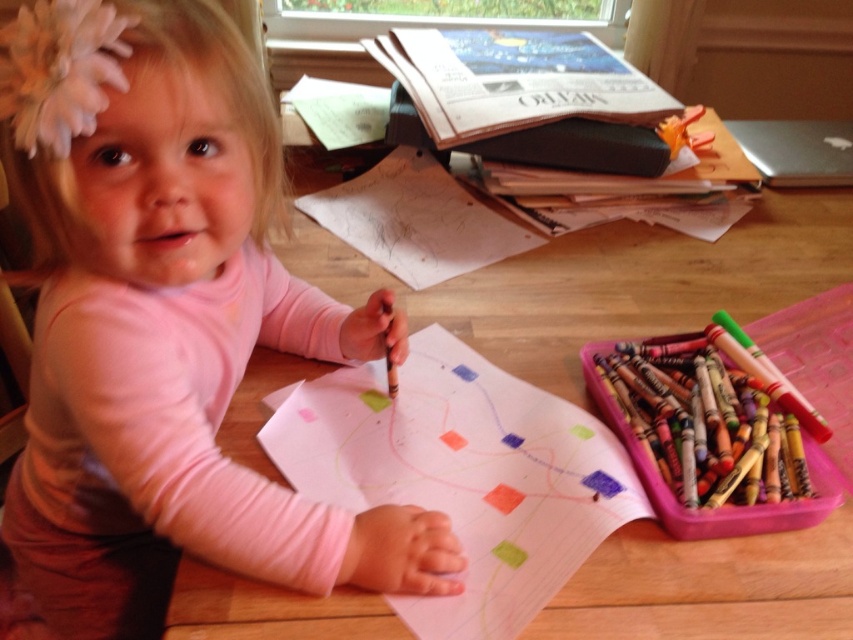
Based on the photo, you are a parent observing your child at the table. You notice the matte pink shirt at center and the smooth white paper at center. Which object is wider?

The matte pink shirt at center is wider than the smooth white paper at center.

You are a parent trying to set up a drawing station for your child. The wooden table at center is where the child will work. Considering the smooth white paper at center, which object is higher and why does it matter?

The wooden table at center is higher than the smooth white paper at center. This matters because the paper needs to be placed on the table to provide a stable surface for the child to draw comfortably.